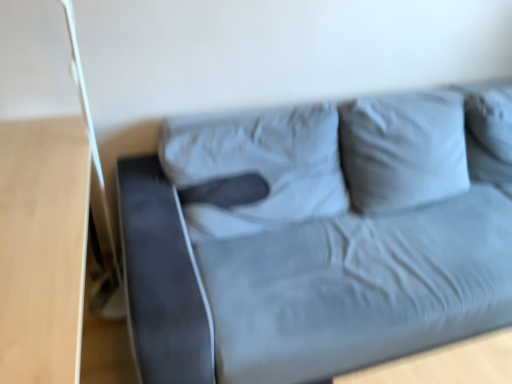
The height and width of the screenshot is (384, 512). What do you see at coordinates (42, 248) in the screenshot? I see `light wood table at left` at bounding box center [42, 248].

What is the approximate width of light wood table at left?

light wood table at left is 54.23 centimeters wide.

At what (x,y) coordinates should I click in order to perform the action: click on light wood table at left. Please return your answer as a coordinate pair (x, y). The image size is (512, 384). Looking at the image, I should click on (42, 248).

The image size is (512, 384). Describe the element at coordinates (319, 236) in the screenshot. I see `suede gray couch at center` at that location.

Identify the location of suede gray couch at center. The image size is (512, 384). (319, 236).

Measure the distance between point (210,270) and camera.

They are 4.67 feet apart.

Identify the location of light wood table at left. The height and width of the screenshot is (384, 512). (42, 248).

Looking at this image, does light wood table at left appear on the left side of suede gray couch at center?

Yes.

Between light wood table at left and suede gray couch at center, which one is positioned behind?

suede gray couch at center is more distant.

Which is less distant, (x=1, y=180) or (x=419, y=166)?

The point (x=1, y=180) is in front.

From the image's perspective, would you say light wood table at left is shown under suede gray couch at center?

Indeed, from the image's perspective, light wood table at left is shown beneath suede gray couch at center.

From a real-world perspective, is light wood table at left physically below suede gray couch at center?

Yes.

Which object is thinner, light wood table at left or suede gray couch at center?

Thinner between the two is light wood table at left.

Is light wood table at left taller or shorter than suede gray couch at center?

In the image, light wood table at left appears to be shorter than suede gray couch at center.

Does light wood table at left have a smaller size compared to suede gray couch at center?

Indeed, light wood table at left has a smaller size compared to suede gray couch at center.

Could suede gray couch at center be considered to be inside light wood table at left?

No, suede gray couch at center is not inside light wood table at left.

Can you see light wood table at left touching suede gray couch at center?

There is a gap between light wood table at left and suede gray couch at center.

Is light wood table at left facing towards suede gray couch at center?

Yes, light wood table at left is oriented towards suede gray couch at center.

Identify the location of studio couch on the right of light wood table at left. (319, 236).

Considering the relative positions of suede gray couch at center and light wood table at left in the image provided, is suede gray couch at center to the right of light wood table at left from the viewer's perspective?

Yes, suede gray couch at center is to the right of light wood table at left.

Does suede gray couch at center lie behind light wood table at left?

That is True.

Which is behind, point (379, 176) or point (25, 265)?

The point (379, 176) is behind.

From the image's perspective, which object appears higher, suede gray couch at center or light wood table at left?

suede gray couch at center is shown above in the image.

From a real-world perspective, which is physically above, suede gray couch at center or light wood table at left?

In real-world perspective, suede gray couch at center is above.

Which of these two, suede gray couch at center or light wood table at left, is thinner?

light wood table at left is thinner.

Considering the sizes of objects suede gray couch at center and light wood table at left in the image provided, who is shorter, suede gray couch at center or light wood table at left?

Standing shorter between the two is light wood table at left.

Who is smaller, suede gray couch at center or light wood table at left?

Smaller between the two is light wood table at left.

Is suede gray couch at center located outside light wood table at left?

Yes, suede gray couch at center is located beyond the bounds of light wood table at left.

Would you say suede gray couch at center is a long distance from light wood table at left?

suede gray couch at center is actually quite close to light wood table at left.

Does suede gray couch at center turn towards light wood table at left?

No.

How many degrees apart are the facing directions of suede gray couch at center and light wood table at left?

The angular difference between suede gray couch at center and light wood table at left is 88.9 degrees.

I want to click on studio couch behind the light wood table at left, so click(319, 236).

The height and width of the screenshot is (384, 512). Identify the location of table lying on the left of suede gray couch at center. (42, 248).

In the image, there is a suede gray couch at center. What are the coordinates of `table below it (from a real-world perspective)` in the screenshot? It's located at (42, 248).